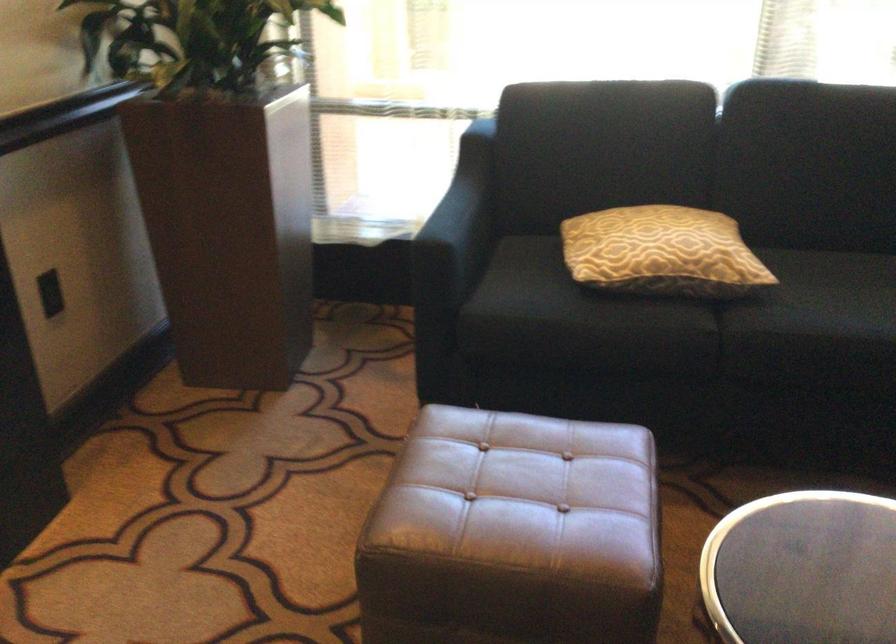
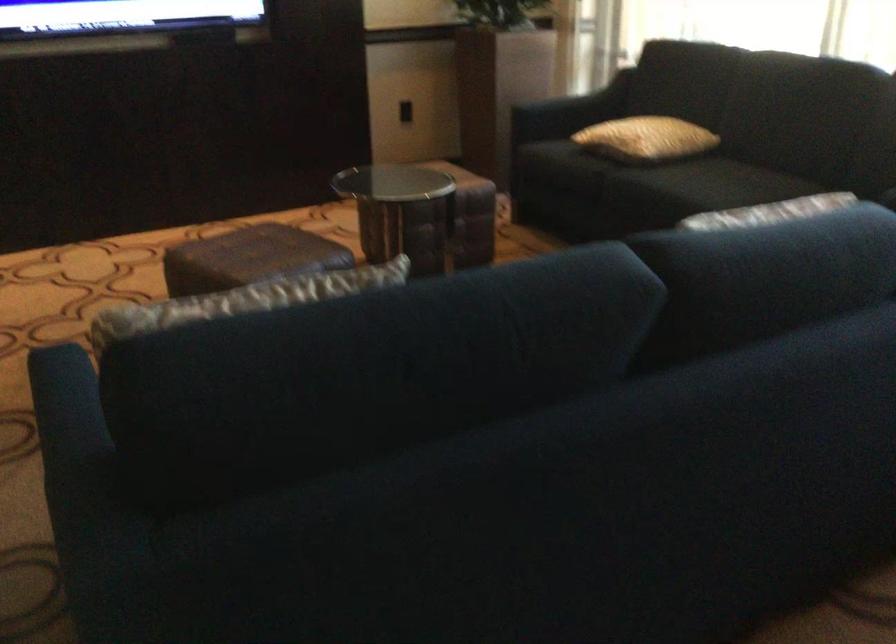
The point at (471, 205) is marked in the first image. Where is the corresponding point in the second image?

(586, 99)